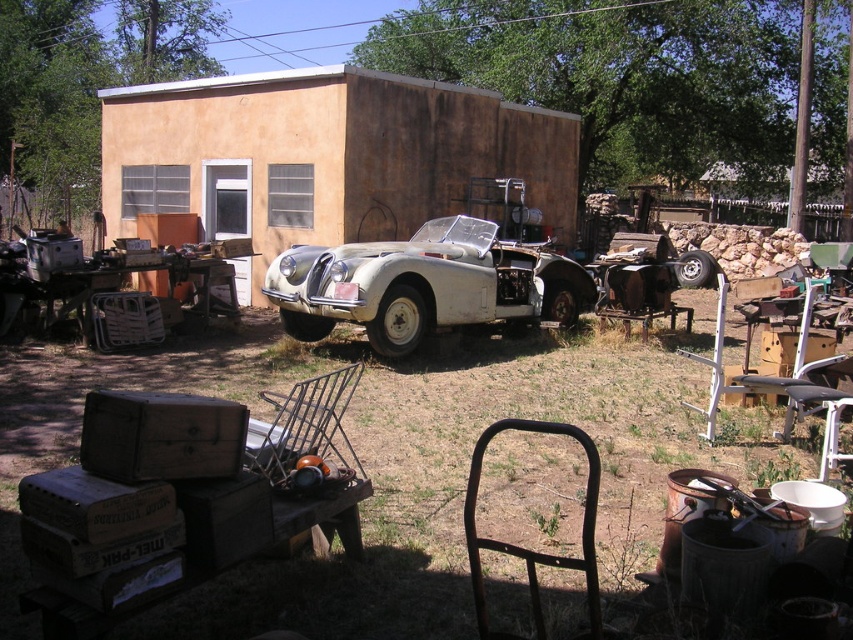
Can you confirm if matte orange wall at center is positioned to the left of rusty metal chair at lower center?

Indeed, matte orange wall at center is positioned on the left side of rusty metal chair at lower center.

Is matte orange wall at center above rusty metal chair at lower center?

Yes.

Where is `matte orange wall at center`? The height and width of the screenshot is (640, 853). matte orange wall at center is located at coordinates (323, 157).

Between matte orange wall at center and white matte car at center, which one is positioned lower?

white matte car at center

The height and width of the screenshot is (640, 853). Describe the element at coordinates (323, 157) in the screenshot. I see `matte orange wall at center` at that location.

You are a GUI agent. You are given a task and a screenshot of the screen. Output one action in this format:
    pyautogui.click(x=<x>, y=<y>)
    Task: Click on the matte orange wall at center
    The image size is (853, 640).
    Given the screenshot: What is the action you would take?
    pyautogui.click(x=323, y=157)

Is white matte car at center below rusty metal chair at lower center?

No, white matte car at center is not below rusty metal chair at lower center.

This screenshot has height=640, width=853. I want to click on white matte car at center, so click(424, 284).